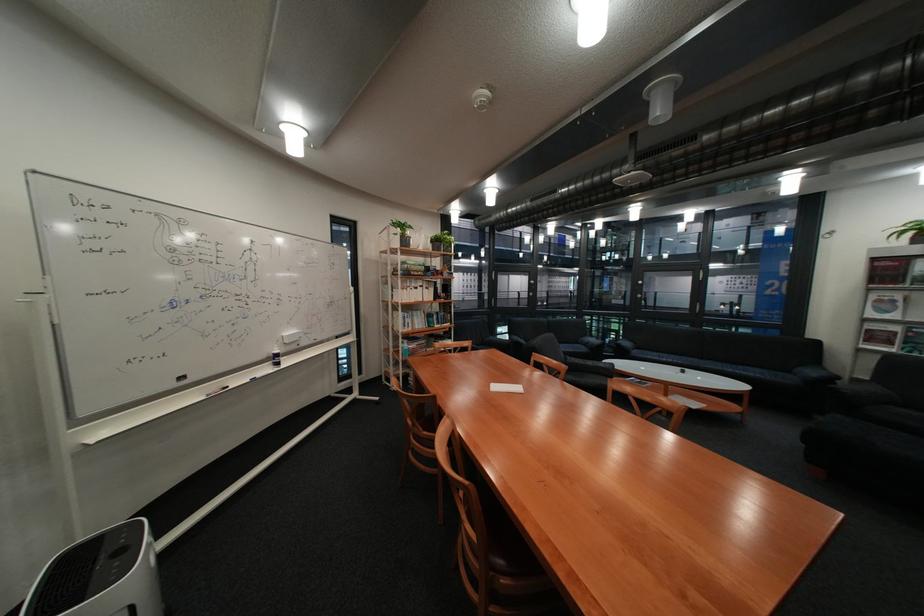
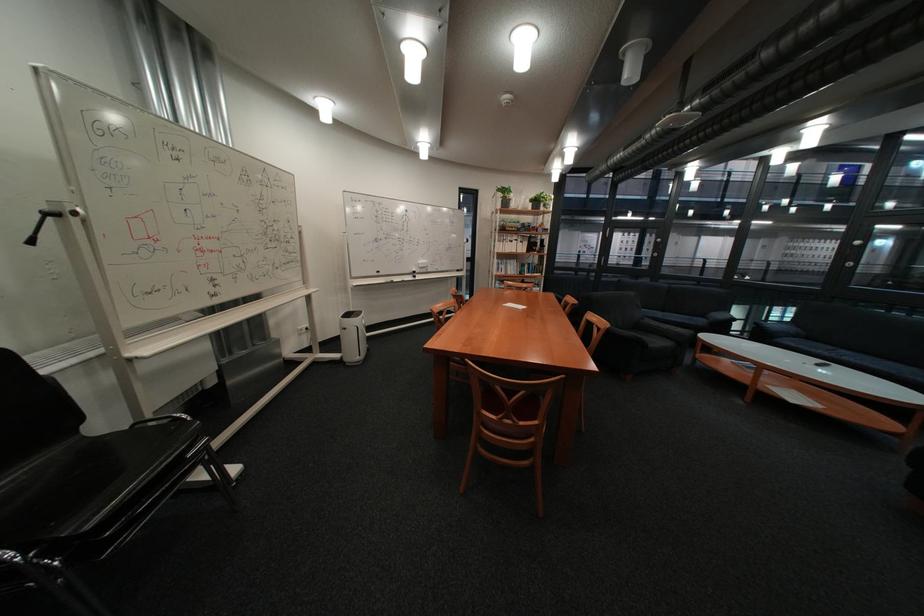
The point at [588,351] is marked in the first image. Where is the corresponding point in the second image?

(698, 321)